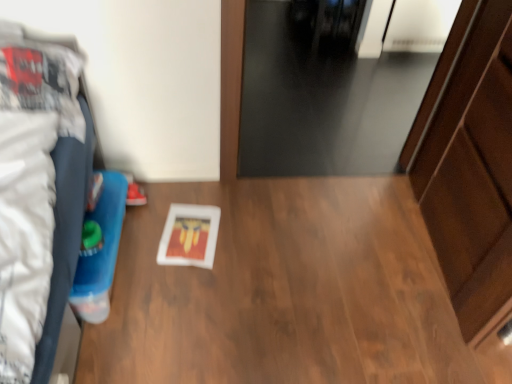
Question: Is point (340, 311) positioned closer to the camera than point (245, 155)?

Choices:
 (A) closer
 (B) farther

Answer: (A)

Question: Is wooden table at center in front of or behind black glass door at upper center in the image?

Choices:
 (A) behind
 (B) front

Answer: (B)

Question: Which of these objects is positioned closest to the wooden dresser at right?

Choices:
 (A) matte red shoe at lower left
 (B) wooden table at center
 (C) black glass door at upper center

Answer: (B)

Question: Which object is the closest to the black glass door at upper center?

Choices:
 (A) matte red shoe at lower left
 (B) wooden table at center
 (C) wooden dresser at right

Answer: (B)